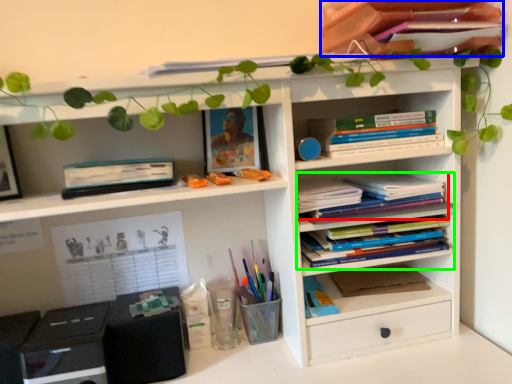
Question: Which is nearer to the book (highlighted by a red box)? book (highlighted by a blue box) or book (highlighted by a green box).

Choices:
 (A) book
 (B) book

Answer: (B)